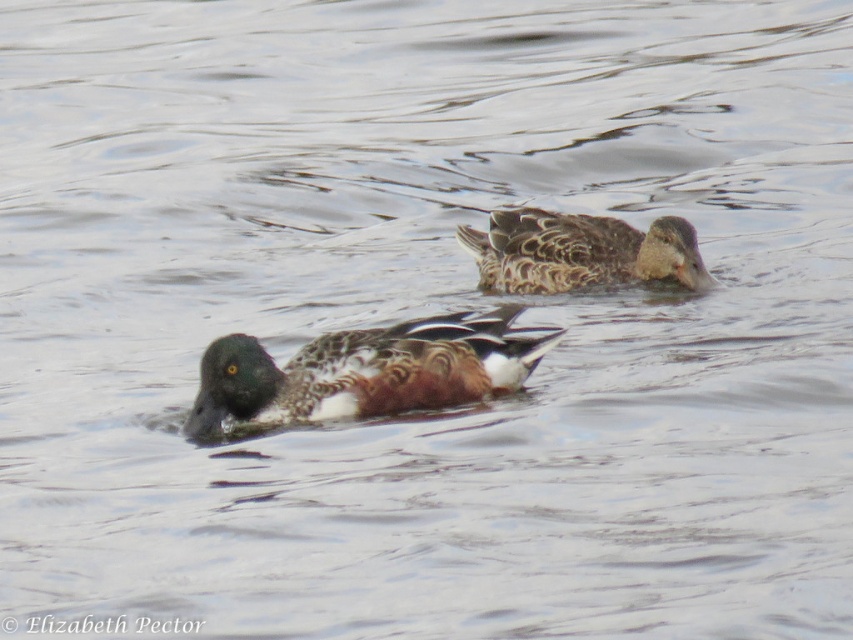
You are observing two points on a map of the duck habitat. The points are labeled as point (496, 323) and point (560, 252). Which point is closer to the observer?

Point (496, 323) is in front of point (560, 252), so it is closer to the observer.